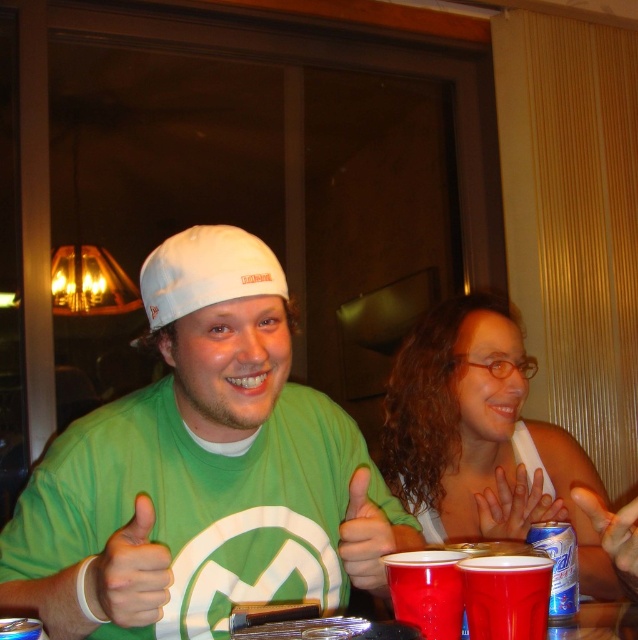
Question: Can you confirm if matte plastic cup at lower center is bigger than blue metallic can at lower right?

Choices:
 (A) no
 (B) yes

Answer: (A)

Question: Where is green matte hand at center located in relation to red plastic cup at center in the image?

Choices:
 (A) right
 (B) left

Answer: (B)

Question: Based on their relative distances, which object is nearer to the green matte hand at center?

Choices:
 (A) matte plastic cup at lower center
 (B) red plastic cup at center

Answer: (A)

Question: Among these points, which one is farthest from the camera?

Choices:
 (A) pos(360,496)
 (B) pos(528,522)
 (C) pos(10,598)

Answer: (B)

Question: Which point is closer to the camera?

Choices:
 (A) coord(401,547)
 (B) coord(477,604)

Answer: (B)

Question: Is red plastic cup at center to the right of blue metallic can at lower right from the viewer's perspective?

Choices:
 (A) yes
 (B) no

Answer: (B)